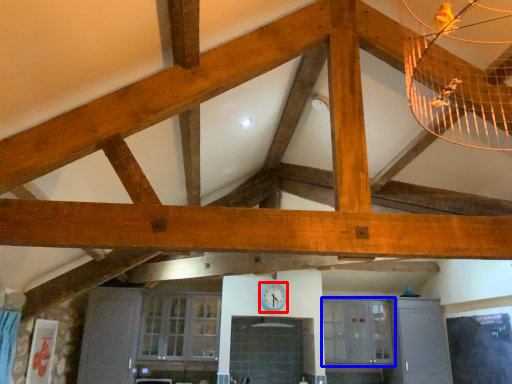
Question: Among these objects, which one is farthest to the camera, clock (highlighted by a red box) or window (highlighted by a blue box)?

Choices:
 (A) clock
 (B) window

Answer: (B)